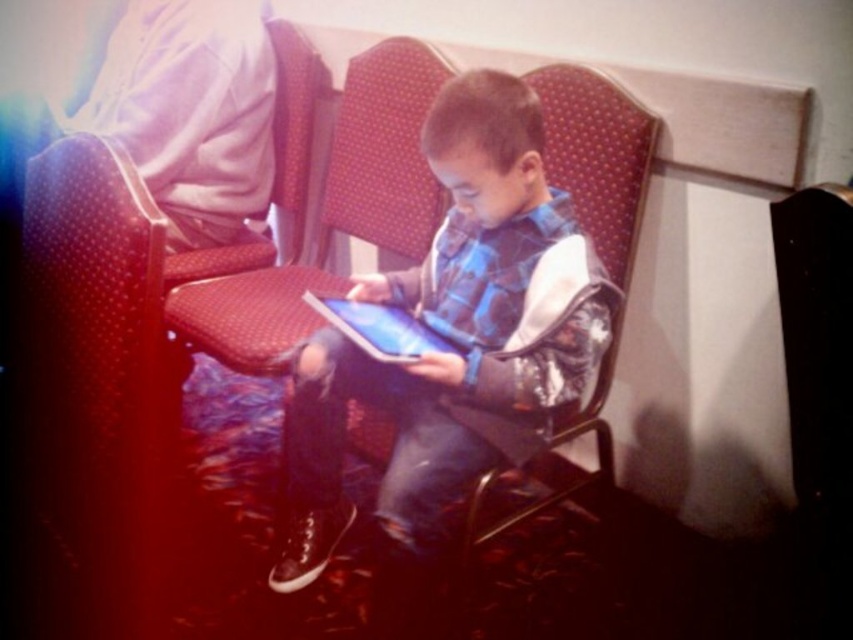
You are a delivery robot in a waiting area. You need to deliver a package to the boy sitting on the red upholstered chair with a patterned design. The package is placed at point (x=379, y=328). Is there an object at that point that might block your delivery?

At point (x=379, y=328) lies matte black tablet at center, so yes, the matte black tablet at center is blocking the delivery path.

You are standing in a waiting area and see the matte blue hoodie at center and the matte red chair at center. Which object is nearer to you?

The matte blue hoodie at center is closer to the viewer than the matte red chair at center.

Where is the matte black tablet at center located in the image?

The matte black tablet at center is located at point coordinates of (379,328).